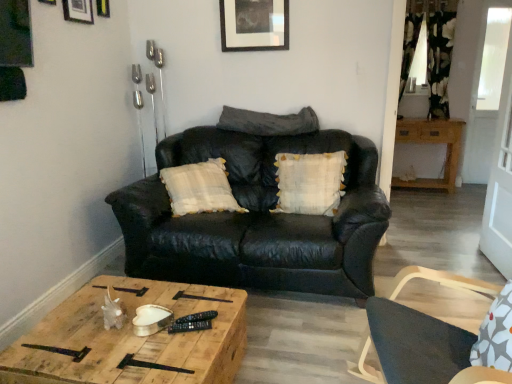
Identify the location of metallic silver picture frame at upper center, positioned as the 2th picture frame in back-to-front order. This screenshot has height=384, width=512. (103, 8).

In order to click on wooden cabinet at right, placed as the 1th table when sorted from back to front in this screenshot , I will do `click(432, 143)`.

This screenshot has height=384, width=512. What are the coordinates of `woodenmaterial/texturetable at center, placed as the second table when sorted from right to left` in the screenshot? It's located at (132, 339).

The height and width of the screenshot is (384, 512). Find the location of `brushed metal picture frame at upper left, which is counted as the first picture frame, starting from the front`. brushed metal picture frame at upper left, which is counted as the first picture frame, starting from the front is located at coordinates (48, 2).

From the image's perspective, which is below, matte black picture frame at upper left, the 3th picture frame viewed from the back, or metallic silver picture frame at upper center, which appears as the 2th picture frame when viewed from the right?

matte black picture frame at upper left, the 3th picture frame viewed from the back, is shown below in the image.

Can you confirm if matte black picture frame at upper left, which ranks as the second picture frame in left-to-right order, is smaller than metallic silver picture frame at upper center, which is the third picture frame in front-to-back order?

Incorrect, matte black picture frame at upper left, which ranks as the second picture frame in left-to-right order, is not smaller in size than metallic silver picture frame at upper center, which is the third picture frame in front-to-back order.

Is matte black picture frame at upper left, which is counted as the 3th picture frame, starting from the right, turned away from metallic silver picture frame at upper center, which appears as the 2th picture frame when viewed from the right?

matte black picture frame at upper left, which is counted as the 3th picture frame, starting from the right, is not turned away from metallic silver picture frame at upper center, which appears as the 2th picture frame when viewed from the right.

Considering the sizes of matte black picture frame at upper left, which is counted as the 3th picture frame, starting from the right, and metallic silver picture frame at upper center, positioned as the 2th picture frame in back-to-front order, in the image, is matte black picture frame at upper left, which is counted as the 3th picture frame, starting from the right, wider or thinner than metallic silver picture frame at upper center, positioned as the 2th picture frame in back-to-front order,?

Considering their sizes, matte black picture frame at upper left, which is counted as the 3th picture frame, starting from the right, looks slimmer than metallic silver picture frame at upper center, positioned as the 2th picture frame in back-to-front order.

Is black leather couch at center taller than woodenmaterial/texturetable at center, which ranks as the first table in bottom-to-top order?

Indeed, black leather couch at center has a greater height compared to woodenmaterial/texturetable at center, which ranks as the first table in bottom-to-top order.

Can you see black leather couch at center touching woodenmaterial/texturetable at center, which is the 1th table in left-to-right order?

No, black leather couch at center is not with woodenmaterial/texturetable at center, which is the 1th table in left-to-right order.

Considering the positions of objects black leather couch at center and woodenmaterial/texturetable at center, which ranks as the 2th table in back-to-front order, in the image provided, who is more to the left, black leather couch at center or woodenmaterial/texturetable at center, which ranks as the 2th table in back-to-front order,?

From the viewer's perspective, woodenmaterial/texturetable at center, which ranks as the 2th table in back-to-front order, appears more on the left side.

In terms of width, does black leather couch at center look wider or thinner when compared to woodenmaterial/texturetable at center, arranged as the second table when viewed from the top?

In the image, black leather couch at center appears to be wider than woodenmaterial/texturetable at center, arranged as the second table when viewed from the top.

Considering the sizes of woodenmaterial/texturetable at center, positioned as the 1th table in front-to-back order, and matte black picture frame at upper left, the 3th picture frame viewed from the back, in the image, is woodenmaterial/texturetable at center, positioned as the 1th table in front-to-back order, bigger or smaller than matte black picture frame at upper left, the 3th picture frame viewed from the back,?

In the image, woodenmaterial/texturetable at center, positioned as the 1th table in front-to-back order, appears to be larger than matte black picture frame at upper left, the 3th picture frame viewed from the back.

Which of these two, woodenmaterial/texturetable at center, which is the 1th table in left-to-right order, or matte black picture frame at upper left, which ranks as the second picture frame in left-to-right order, is wider?

Wider between the two is woodenmaterial/texturetable at center, which is the 1th table in left-to-right order.

Is woodenmaterial/texturetable at center, positioned as the 1th table in front-to-back order, aimed at matte black picture frame at upper left, which is counted as the second picture frame, starting from the front?

No, woodenmaterial/texturetable at center, positioned as the 1th table in front-to-back order, is not facing towards matte black picture frame at upper left, which is counted as the second picture frame, starting from the front.

Which of these two, woodenmaterial/texturetable at center, placed as the second table when sorted from right to left, or matte black picture frame at upper left, which ranks as the second picture frame in left-to-right order, stands taller?

woodenmaterial/texturetable at center, placed as the second table when sorted from right to left, is taller.

Would you say brushed metal picture frame at upper left, which is counted as the first picture frame, starting from the front, is a long distance from woodenmaterial/texturetable at center, which ranks as the first table in bottom-to-top order?

Yes, brushed metal picture frame at upper left, which is counted as the first picture frame, starting from the front, and woodenmaterial/texturetable at center, which ranks as the first table in bottom-to-top order, are located far from each other.

Does brushed metal picture frame at upper left, which is counted as the first picture frame, starting from the front, have a greater width compared to woodenmaterial/texturetable at center, arranged as the second table when viewed from the top?

No, brushed metal picture frame at upper left, which is counted as the first picture frame, starting from the front, is not wider than woodenmaterial/texturetable at center, arranged as the second table when viewed from the top.

Is point (52, 1) farther from camera compared to point (215, 363)?

Yes, it is.

Which object is more forward, metallic silver picture frame at upper center, acting as the 3th picture frame starting from the left, or matte black picture frame at upper left, the 3th picture frame viewed from the back?

matte black picture frame at upper left, the 3th picture frame viewed from the back, is more forward.

Measure the distance between metallic silver picture frame at upper center, acting as the 3th picture frame starting from the left, and matte black picture frame at upper left, which ranks as the second picture frame in left-to-right order.

metallic silver picture frame at upper center, acting as the 3th picture frame starting from the left, and matte black picture frame at upper left, which ranks as the second picture frame in left-to-right order, are 8.95 inches apart from each other.

Is matte black picture frame at upper left, the 3th picture frame viewed from the back, inside metallic silver picture frame at upper center, which appears as the 2th picture frame when viewed from the right?

Definitely not — matte black picture frame at upper left, the 3th picture frame viewed from the back, is not inside metallic silver picture frame at upper center, which appears as the 2th picture frame when viewed from the right.

Between black leather couch at center and matte black picture frame at upper center, arranged as the fourth picture frame when viewed from the front, which one appears on the right side from the viewer's perspective?

From the viewer's perspective, black leather couch at center appears more on the right side.

Is black leather couch at center outside of matte black picture frame at upper center, marked as the first picture frame in a back-to-front arrangement?

Yes, black leather couch at center is outside of matte black picture frame at upper center, marked as the first picture frame in a back-to-front arrangement.

From the image's perspective, who appears lower, black leather couch at center or matte black picture frame at upper center, which is the 4th picture frame in left-to-right order?

black leather couch at center, from the image's perspective.

Does black leather couch at center lie in front of matte black picture frame at upper center, arranged as the fourth picture frame when viewed from the front?

Yes, black leather couch at center is in front of matte black picture frame at upper center, arranged as the fourth picture frame when viewed from the front.

Is matte black picture frame at upper center, marked as the first picture frame in a back-to-front arrangement, positioned far away from woodenmaterial/texturetable at center, arranged as the second table when viewed from the top?

Yes.

Can you tell me how much matte black picture frame at upper center, which is the 4th picture frame in left-to-right order, and woodenmaterial/texturetable at center, which ranks as the 2th table in back-to-front order, differ in facing direction?

matte black picture frame at upper center, which is the 4th picture frame in left-to-right order, and woodenmaterial/texturetable at center, which ranks as the 2th table in back-to-front order, are facing 85 degrees away from each other.

In the image, is matte black picture frame at upper center, which appears as the first picture frame when viewed from the right, positioned in front of or behind woodenmaterial/texturetable at center, positioned as the 1th table in front-to-back order?

In the image, matte black picture frame at upper center, which appears as the first picture frame when viewed from the right, appears behind woodenmaterial/texturetable at center, positioned as the 1th table in front-to-back order.

Which is nearer, (250, 30) or (197, 336)?

The point (197, 336) is closer.

From the image's perspective, starting from the metallic silver picture frame at upper center, which is the third picture frame in front-to-back order, which picture frame is the 1st one below? Please provide its 2D coordinates.

[(78, 11)]

This screenshot has height=384, width=512. Identify the location of studio couch on the right side of woodenmaterial/texturetable at center, which ranks as the 2th table in back-to-front order. coord(256,219).

Estimate the real-world distances between objects in this image. Which object is closer to metallic silver picture frame at upper center, acting as the 3th picture frame starting from the left, matte black chair at right or wooden cabinet at right, placed as the 1th table when sorted from back to front?

matte black chair at right lies closer to metallic silver picture frame at upper center, acting as the 3th picture frame starting from the left, than the other object.

Based on their spatial positions, is matte black chair at right or white textured pillow at center, positioned as the 2th pillow in top-to-bottom order, closer to matte black picture frame at upper left, which is counted as the second picture frame, starting from the front?

white textured pillow at center, positioned as the 2th pillow in top-to-bottom order.

When comparing their distances from black leather couch at center, does matte black chair at right or brushed metal picture frame at upper left, which is counted as the first picture frame, starting from the front, seem closer?

matte black chair at right lies closer to black leather couch at center than the other object.

Considering their positions, is matte black picture frame at upper left, which is counted as the second picture frame, starting from the front, positioned closer to matte black chair at right than brushed metal picture frame at upper left, which is counted as the 4th picture frame, starting from the back?

The object closer to matte black chair at right is brushed metal picture frame at upper left, which is counted as the 4th picture frame, starting from the back.

Considering their positions, is white textured pillow at center, positioned as the 2th pillow in top-to-bottom order, positioned closer to woodenmaterial/texturetable at center, which is the 1th table in left-to-right order, than matte black picture frame at upper center, which is the 4th picture frame in left-to-right order?

white textured pillow at center, positioned as the 2th pillow in top-to-bottom order, is closer to woodenmaterial/texturetable at center, which is the 1th table in left-to-right order.

Considering their positions, is brushed metal picture frame at upper left, which is counted as the 4th picture frame, starting from the back, positioned further to dark gray leather pillow at center, the second pillow from the bottom, than matte black picture frame at upper center, which is the 4th picture frame in left-to-right order?

brushed metal picture frame at upper left, which is counted as the 4th picture frame, starting from the back, lies further to dark gray leather pillow at center, the second pillow from the bottom, than the other object.

Looking at the image, which one is located closer to matte black picture frame at upper left, which is counted as the second picture frame, starting from the front, woodenmaterial/texturetable at center, positioned as the 1th table in front-to-back order, or dark gray leather pillow at center, placed as the 1th pillow when sorted from top to bottom?

The object closer to matte black picture frame at upper left, which is counted as the second picture frame, starting from the front, is dark gray leather pillow at center, placed as the 1th pillow when sorted from top to bottom.

From the picture: Based on their spatial positions, is brushed metal picture frame at upper left, arranged as the 1th picture frame when viewed from the left, or metallic silver picture frame at upper center, which appears as the 2th picture frame when viewed from the right, closer to wooden cabinet at right, which is counted as the 2th table, starting from the front?

metallic silver picture frame at upper center, which appears as the 2th picture frame when viewed from the right, is positioned closer to the anchor wooden cabinet at right, which is counted as the 2th table, starting from the front.

At what (x,y) coordinates should I click in order to perform the action: click on studio couch between matte black chair at right and wooden cabinet at right, which is counted as the 2th table, starting from the front, along the z-axis. Please return your answer as a coordinate pair (x, y). Looking at the image, I should click on (256, 219).

At what (x,y) coordinates should I click in order to perform the action: click on pillow between woodenmaterial/texturetable at center, arranged as the second table when viewed from the top, and dark gray leather pillow at center, the second pillow from the bottom, in the front-back direction. Please return your answer as a coordinate pair (x, y). Image resolution: width=512 pixels, height=384 pixels. Looking at the image, I should click on (310, 182).

The width and height of the screenshot is (512, 384). What are the coordinates of `studio couch located between woodenmaterial/texturetable at center, arranged as the second table when viewed from the top, and dark gray leather pillow at center, placed as the 1th pillow when sorted from top to bottom, in the depth direction` in the screenshot? It's located at (256, 219).

Where is `pillow between matte black chair at right and dark gray leather pillow at center, the second pillow from the bottom, in the front-back direction`? pillow between matte black chair at right and dark gray leather pillow at center, the second pillow from the bottom, in the front-back direction is located at coordinates (310, 182).